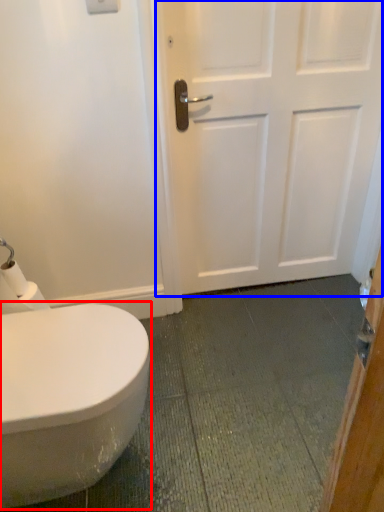
Question: Which of the following is the farthest to the observer, bidet (highlighted by a red box) or door (highlighted by a blue box)?

Choices:
 (A) bidet
 (B) door

Answer: (B)